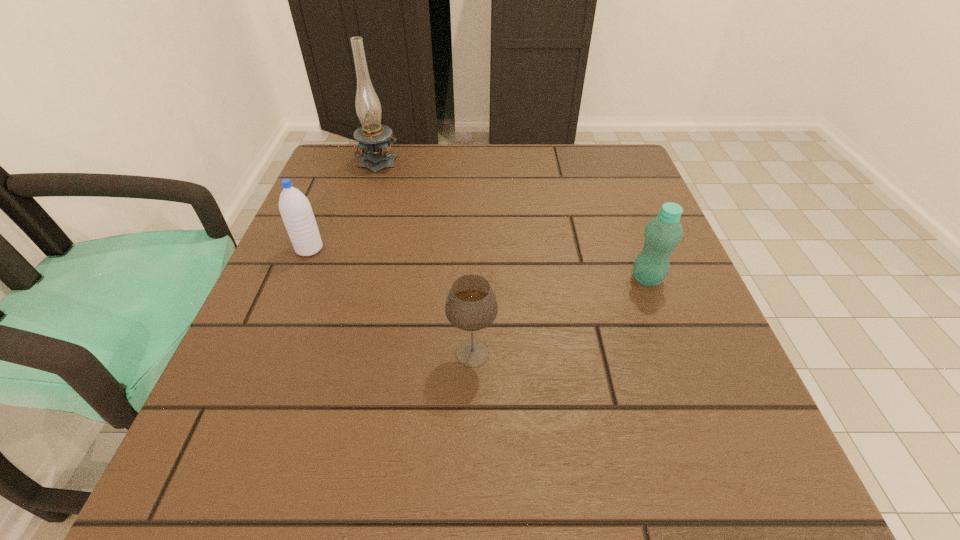
The height and width of the screenshot is (540, 960). I want to click on the tallest object, so click(374, 139).

This screenshot has height=540, width=960. I want to click on the third object from right to left, so click(x=374, y=139).

In order to click on the right water bottle in this screenshot , I will do `click(663, 233)`.

Image resolution: width=960 pixels, height=540 pixels. In order to click on the second nearest object in this screenshot , I will do `click(663, 233)`.

Where is `the farther water bottle`? The height and width of the screenshot is (540, 960). the farther water bottle is located at coordinates (295, 209).

Identify the location of the leftmost object. (295, 209).

In order to click on wineglass in this screenshot , I will do `click(471, 305)`.

Locate an element on the screen. This screenshot has height=540, width=960. the third object from left to right is located at coordinates (471, 305).

The width and height of the screenshot is (960, 540). I want to click on vacant space located 0.310m on the front of the farthest object, so click(348, 256).

Identify the location of free space located at the front cap of the rightmost object. This screenshot has width=960, height=540. (463, 279).